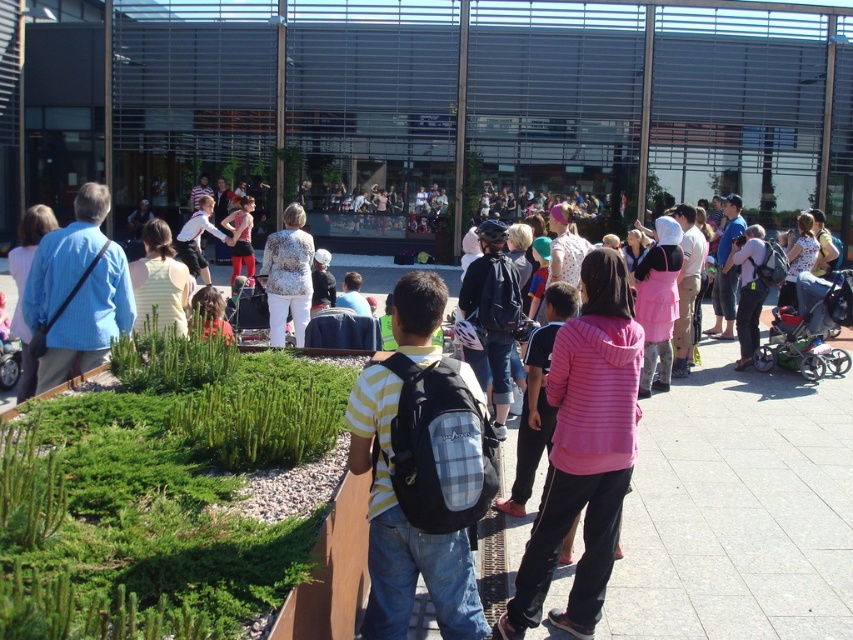
You are standing at the entrance of the modern building and want to reach the stage inside. There are two points marked on the walkway leading to the building. Which point should you aim for first if you want to reach the stage quickly? The two points are point 1 at coordinates (397, 392) and point 2 at coordinates (309, 252).

Point 1 at coordinates (397, 392) is in front of point 2 at coordinates (309, 252), so you should aim for point 1 first to reach the stage quickly.